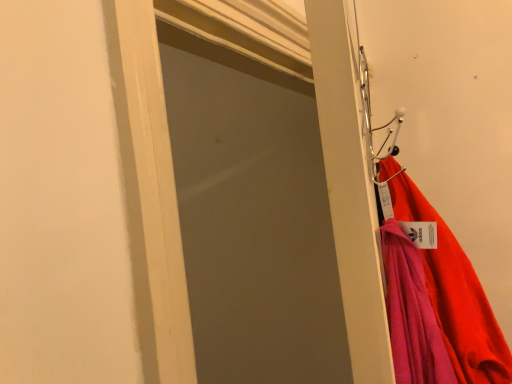
You are a GUI agent. You are given a task and a screenshot of the screen. Output one action in this format:
    pyautogui.click(x=<x>, y=<y>)
    Task: Click on the silky red fabric at right
    Image resolution: width=512 pixels, height=384 pixels.
    Given the screenshot: What is the action you would take?
    pyautogui.click(x=456, y=296)

The width and height of the screenshot is (512, 384). Describe the element at coordinates (456, 296) in the screenshot. I see `silky red fabric at right` at that location.

You are a GUI agent. You are given a task and a screenshot of the screen. Output one action in this format:
    pyautogui.click(x=<x>, y=<y>)
    Task: Click on the silky red fabric at right
    Image resolution: width=512 pixels, height=384 pixels.
    Given the screenshot: What is the action you would take?
    pyautogui.click(x=456, y=296)